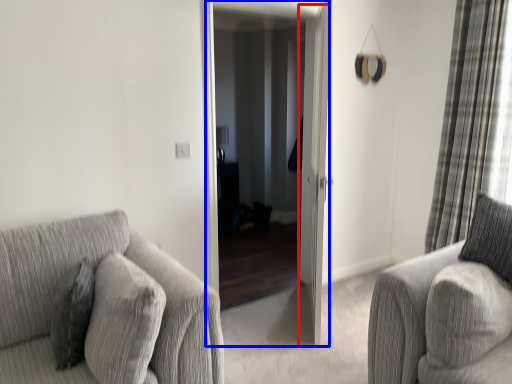
Question: Which of the following is the farthest to the observer, screen door (highlighted by a red box) or screen door (highlighted by a blue box)?

Choices:
 (A) screen door
 (B) screen door

Answer: (B)